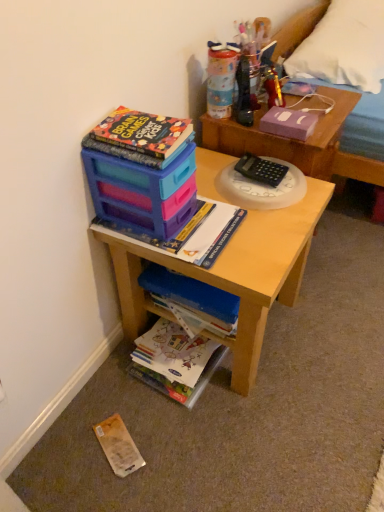
This screenshot has width=384, height=512. What are the coordinates of `vacant area that lies to the right of matte plastic stack at upper center, which is the 2th book from top to bottom` in the screenshot? It's located at click(x=263, y=241).